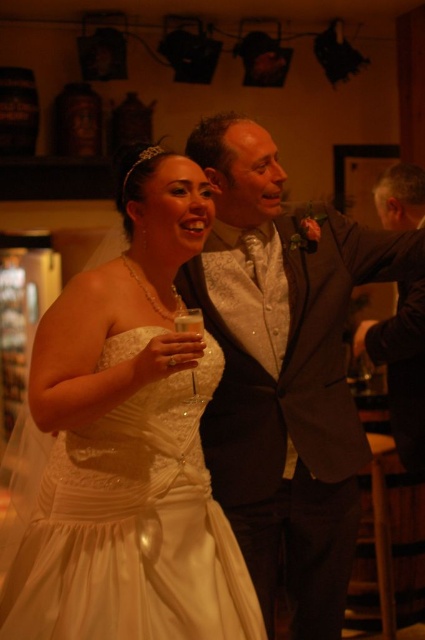
Based on the photo, you are a photographer at the wedding reception. You want to capture a photo of both the ivory satin dress at center and the shiny silver vest at center in the same frame. Which one should you position to the left in your camera viewfinder to align with their actual positions?

The ivory satin dress at center should be positioned to the left in the camera viewfinder because it is actually on the left side of the shiny silver vest at center.

You are a photographer at the wedding reception trying to capture the perfect shot. You notice two points in the scene labeled as point (277, 339) and point (377, 362). Which of these points is closer to your camera lens?

Point (277, 339) is closer to the camera than point (377, 362).

You are standing at the back of the reception hall and want to take a photo of the bride and groom. There are two points marked in the image. Point A is at coordinates point (110, 625) and Point B is at coordinates point (325, 332). Which point should you stand closer to in order to capture both the bride and groom clearly in your photo?

Point A at coordinates point (110, 625) is in front of point B at coordinates point (325, 332). Therefore, standing closer to Point A would allow you to capture both the bride and groom clearly as it is positioned closer to them.